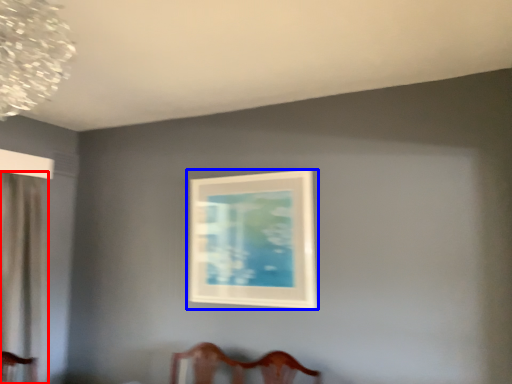
Question: Which point is further to the camera, curtain (highlighted by a red box) or picture frame (highlighted by a blue box)?

Choices:
 (A) curtain
 (B) picture frame

Answer: (B)